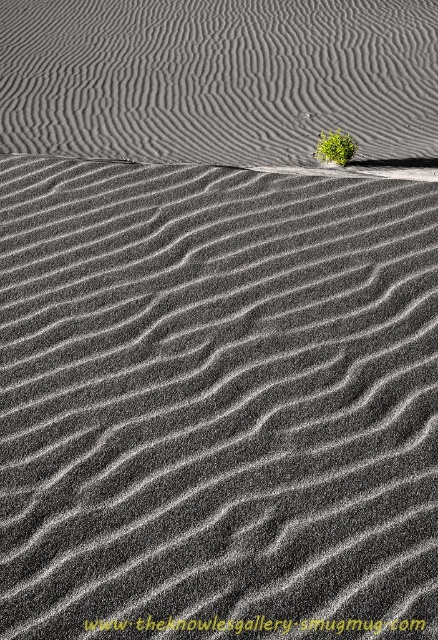
Question: Does gray textured sand at upper center lie behind green leafy plant at upper center?

Choices:
 (A) yes
 (B) no

Answer: (B)

Question: Does gray textured sand at upper center have a smaller size compared to green leafy plant at upper center?

Choices:
 (A) yes
 (B) no

Answer: (B)

Question: Is gray textured sand at upper center smaller than green leafy plant at upper center?

Choices:
 (A) no
 (B) yes

Answer: (A)

Question: Which object appears closest to the camera in this image?

Choices:
 (A) gray textured sand at upper center
 (B) green leafy plant at upper center

Answer: (A)

Question: Among these points, which one is nearest to the camera?

Choices:
 (A) (356, 145)
 (B) (67, 118)

Answer: (A)